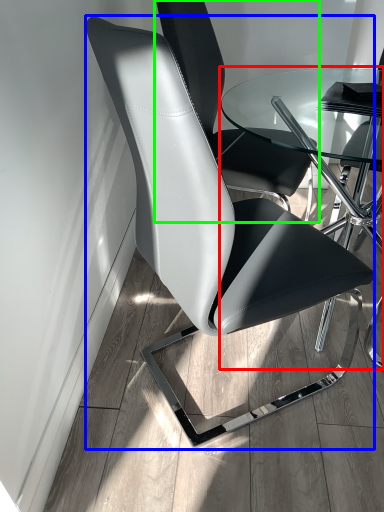
Question: Based on their relative distances, which object is nearer to table (highlighted by a red box)? Choose from chair (highlighted by a blue box) and chair (highlighted by a green box).

Choices:
 (A) chair
 (B) chair

Answer: (B)